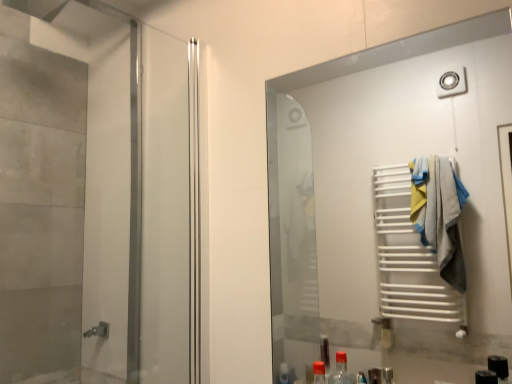
What do you see at coordinates (94, 199) in the screenshot?
I see `matte silver elevator at left` at bounding box center [94, 199].

Find the location of a particular element. matte silver elevator at left is located at coordinates (94, 199).

What are the coordinates of `white matte towel rack at right` in the screenshot? It's located at (390, 208).

Describe the element at coordinates (390, 208) in the screenshot. I see `white matte towel rack at right` at that location.

Image resolution: width=512 pixels, height=384 pixels. I want to click on matte silver elevator at left, so click(x=94, y=199).

Visually, is matte silver elevator at left positioned to the left or to the right of white matte towel rack at right?

In the image, matte silver elevator at left appears on the left side of white matte towel rack at right.

Is matte silver elevator at left in front of or behind white matte towel rack at right in the image?

matte silver elevator at left is positioned farther from the viewer than white matte towel rack at right.

Which is farther, (37, 251) or (278, 223)?

Point (278, 223)

From the image's perspective, which is above, matte silver elevator at left or white matte towel rack at right?

matte silver elevator at left, from the image's perspective.

From a real-world perspective, is matte silver elevator at left under white matte towel rack at right?

No, from a real-world perspective, matte silver elevator at left is not beneath white matte towel rack at right.

Does matte silver elevator at left have a greater width compared to white matte towel rack at right?

Correct, the width of matte silver elevator at left exceeds that of white matte towel rack at right.

Does matte silver elevator at left have a greater height compared to white matte towel rack at right?

Correct, matte silver elevator at left is much taller as white matte towel rack at right.

Considering the relative sizes of matte silver elevator at left and white matte towel rack at right in the image provided, is matte silver elevator at left bigger than white matte towel rack at right?

Yes, matte silver elevator at left is bigger than white matte towel rack at right.

Which is correct: matte silver elevator at left is inside white matte towel rack at right, or outside of it?

matte silver elevator at left is not enclosed by white matte towel rack at right.

Is there a large distance between matte silver elevator at left and white matte towel rack at right?

That's right, there is a large distance between matte silver elevator at left and white matte towel rack at right.

Could you tell me if matte silver elevator at left is facing white matte towel rack at right?

Yes.

How many degrees apart are the facing directions of matte silver elevator at left and white matte towel rack at right?

matte silver elevator at left and white matte towel rack at right are facing 90 degrees away from each other.

Image resolution: width=512 pixels, height=384 pixels. Identify the location of elevator behind the white matte towel rack at right. (94, 199).

In the image, is white matte towel rack at right on the left side or the right side of matte silver elevator at left?

Based on their positions, white matte towel rack at right is located to the right of matte silver elevator at left.

In the image, is white matte towel rack at right positioned in front of or behind matte silver elevator at left?

Clearly, white matte towel rack at right is in front of matte silver elevator at left.

Is point (470, 75) closer or farther from the camera than point (95, 371)?

Point (470, 75).

From the image's perspective, is white matte towel rack at right located beneath matte silver elevator at left?

Correct, white matte towel rack at right appears lower than matte silver elevator at left in the image.

From a real-world perspective, is white matte towel rack at right on matte silver elevator at left?

No, from a real-world perspective, white matte towel rack at right is not over matte silver elevator at left

Can you confirm if white matte towel rack at right is wider than matte silver elevator at left?

In fact, white matte towel rack at right might be narrower than matte silver elevator at left.

Consider the image. Which of these two, white matte towel rack at right or matte silver elevator at left, stands shorter?

white matte towel rack at right is shorter.

Which of these two, white matte towel rack at right or matte silver elevator at left, is bigger?

With larger size is matte silver elevator at left.

Is white matte towel rack at right not inside matte silver elevator at left?

white matte towel rack at right is positioned outside matte silver elevator at left.

Is white matte towel rack at right far away from matte silver elevator at left?

Yes.

Could you tell me if white matte towel rack at right is facing matte silver elevator at left?

No, white matte towel rack at right does not turn towards matte silver elevator at left.

How different are the orientations of white matte towel rack at right and matte silver elevator at left in degrees?

The angle between the facing direction of white matte towel rack at right and the facing direction of matte silver elevator at left is 90 degrees.

This screenshot has width=512, height=384. What are the coordinates of `elevator above the white matte towel rack at right (from the image's perspective)` in the screenshot? It's located at (94, 199).

This screenshot has width=512, height=384. Find the location of `door below the matte silver elevator at left (from a real-world perspective)`. door below the matte silver elevator at left (from a real-world perspective) is located at coordinates (390, 208).

What are the coordinates of `elevator that is behind the white matte towel rack at right` in the screenshot? It's located at (94, 199).